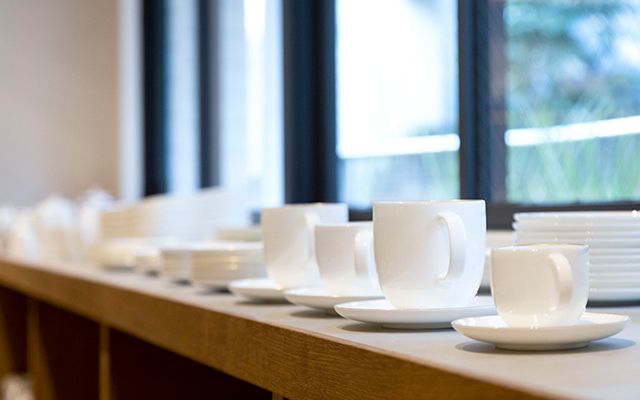
Image resolution: width=640 pixels, height=400 pixels. I want to click on white saucers, so click(248, 292), click(297, 296), click(371, 312), click(527, 335).